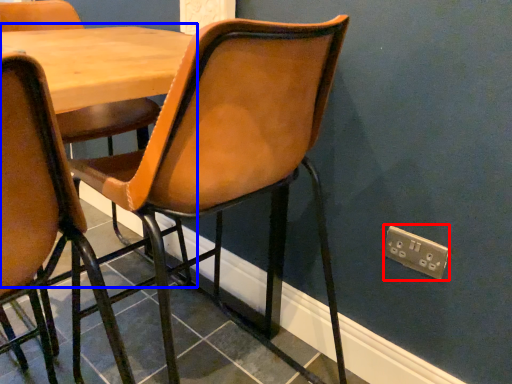
Question: Which object appears farthest to the camera in this image, electric outlet (highlighted by a red box) or table (highlighted by a blue box)?

Choices:
 (A) electric outlet
 (B) table

Answer: (A)